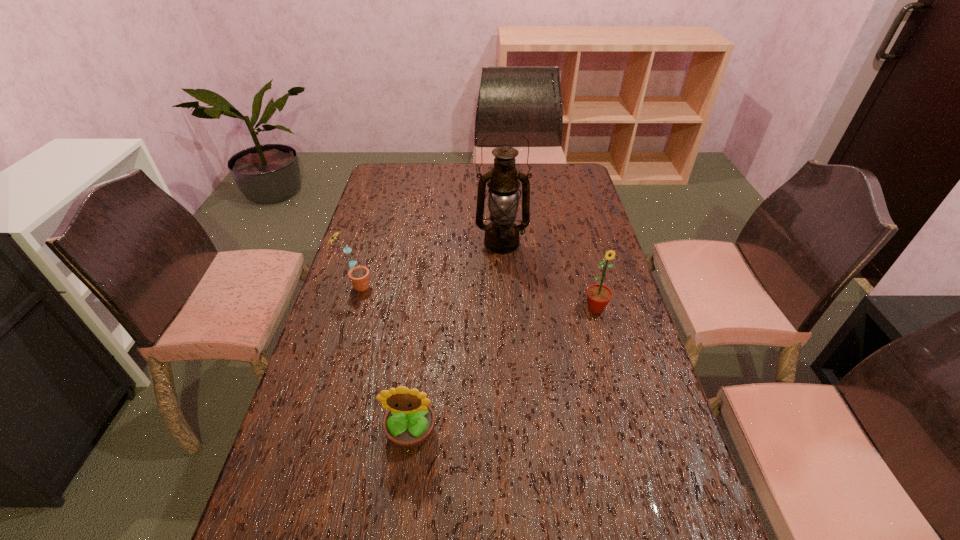
Choose which object is the nearest neighbor to the farthest sunflower. Please provide its 2D coordinates. Your answer should be formatted as a tuple, i.e. [(x, y)], where the tuple contains the x and y coordinates of a point satisfying the conditions above.

[(501, 236)]

Locate an element on the screen. The height and width of the screenshot is (540, 960). sunflower that is the closest one to the shortest object is located at coordinates (359, 275).

Select which sunflower is the second closest to the second farthest sunflower. Please provide its 2D coordinates. Your answer should be formatted as a tuple, i.e. [(x, y)], where the tuple contains the x and y coordinates of a point satisfying the conditions above.

[(359, 275)]